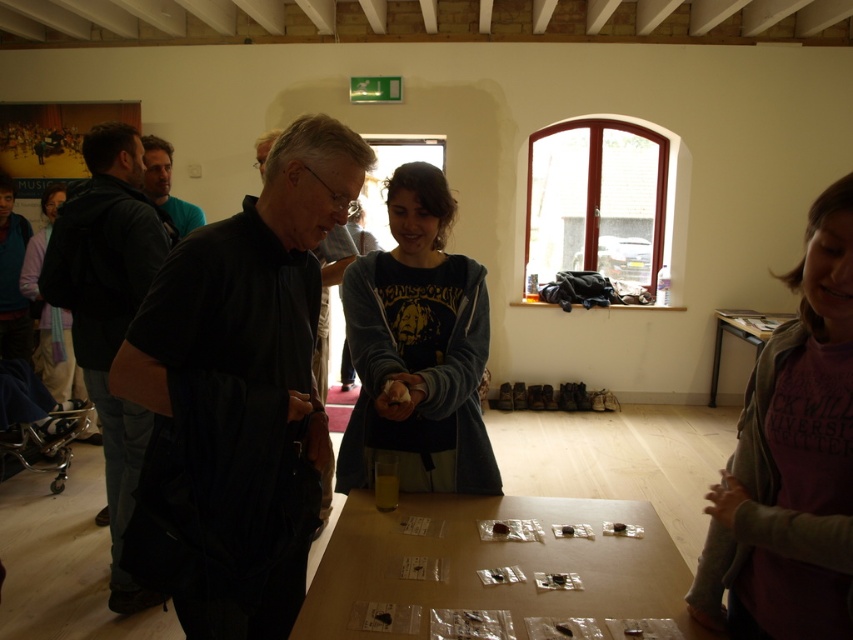
Question: Which point is closer to the camera?

Choices:
 (A) wooden table at lower right
 (B) black leather jacket at left

Answer: (B)

Question: Can you confirm if black leather jacket at left is thinner than matte black jacket at upper left?

Choices:
 (A) yes
 (B) no

Answer: (B)

Question: From the image, what is the correct spatial relationship of dark matte shirt at center in relation to black leather jacket at left?

Choices:
 (A) below
 (B) above

Answer: (B)

Question: Considering the real-world distances, which object is closest to the dark gray sweatshirt at center?

Choices:
 (A) purple cotton shirt at lower right
 (B) wooden table at lower right
 (C) clear plastic table at center
 (D) dark matte shirt at center

Answer: (C)

Question: Does dark gray sweatshirt at center have a smaller size compared to wooden table at lower right?

Choices:
 (A) yes
 (B) no

Answer: (A)

Question: Which point is closer to the camera taking this photo?

Choices:
 (A) (759, 502)
 (B) (755, 317)
 (C) (51, 205)
 (D) (270, 561)

Answer: (A)